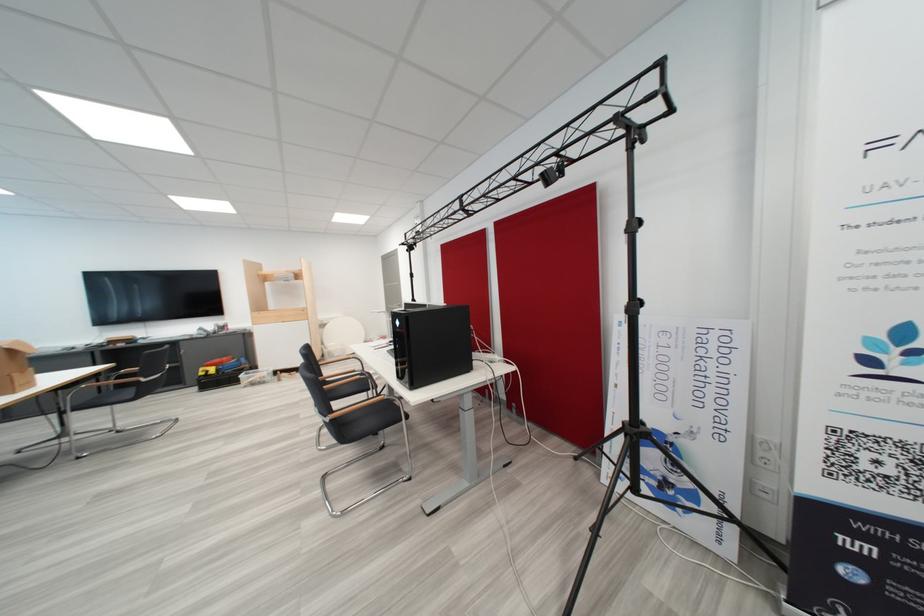
In order to click on wooden chair armrest in this screenshot , I will do `click(357, 406)`.